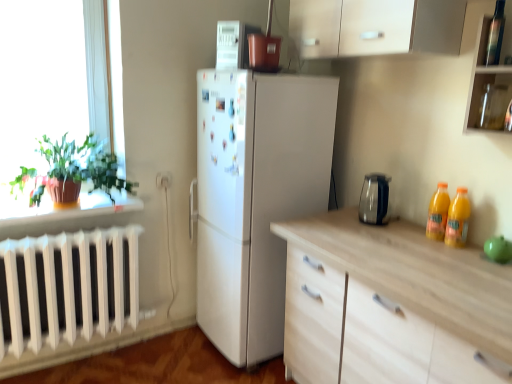
Question: Is orange plastic bottles at right, which appears as the first bottle when viewed from the back, located within white glossy microwave at upper center?

Choices:
 (A) no
 (B) yes

Answer: (A)

Question: Is white glossy microwave at upper center behind orange plastic bottles at right, which is the third bottle from front to back?

Choices:
 (A) no
 (B) yes

Answer: (B)

Question: Does white glossy microwave at upper center appear on the right side of orange plastic bottles at right, which is counted as the 2th bottle, starting from the top?

Choices:
 (A) no
 (B) yes

Answer: (A)

Question: From a real-world perspective, is white glossy microwave at upper center beneath orange plastic bottles at right, which is the third bottle from front to back?

Choices:
 (A) no
 (B) yes

Answer: (A)

Question: From the image's perspective, is white glossy microwave at upper center on orange plastic bottles at right, which is the third bottle from front to back?

Choices:
 (A) no
 (B) yes

Answer: (B)

Question: Is white glossy microwave at upper center oriented away from orange plastic bottles at right, which is counted as the 2th bottle, starting from the top?

Choices:
 (A) yes
 (B) no

Answer: (B)

Question: Does transparent glass jar at upper right have a greater width compared to white glossy microwave at upper center?

Choices:
 (A) yes
 (B) no

Answer: (B)

Question: Is transparent glass jar at upper right in contact with white glossy microwave at upper center?

Choices:
 (A) yes
 (B) no

Answer: (B)

Question: Is transparent glass jar at upper right positioned behind white glossy microwave at upper center?

Choices:
 (A) yes
 (B) no

Answer: (B)

Question: Considering the relative sizes of transparent glass jar at upper right and white glossy microwave at upper center in the image provided, is transparent glass jar at upper right smaller than white glossy microwave at upper center?

Choices:
 (A) no
 (B) yes

Answer: (B)

Question: From a real-world perspective, is transparent glass jar at upper right on top of white glossy microwave at upper center?

Choices:
 (A) yes
 (B) no

Answer: (B)

Question: Is transparent glass jar at upper right at the left side of white glossy microwave at upper center?

Choices:
 (A) yes
 (B) no

Answer: (B)

Question: Can you confirm if yellow glass bottles at right, the 3th bottle in the top-to-bottom sequence, is smaller than transparent glass jar at upper right?

Choices:
 (A) no
 (B) yes

Answer: (B)